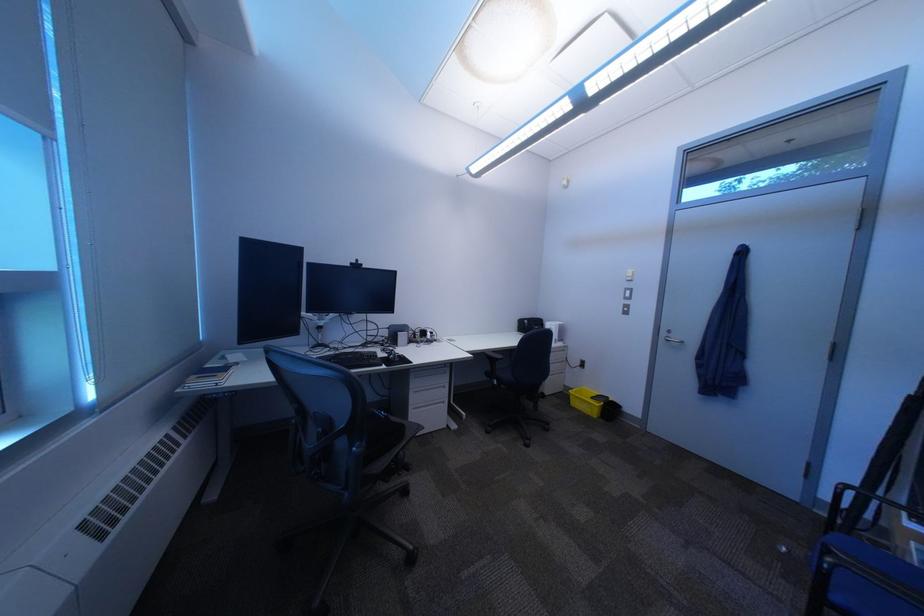
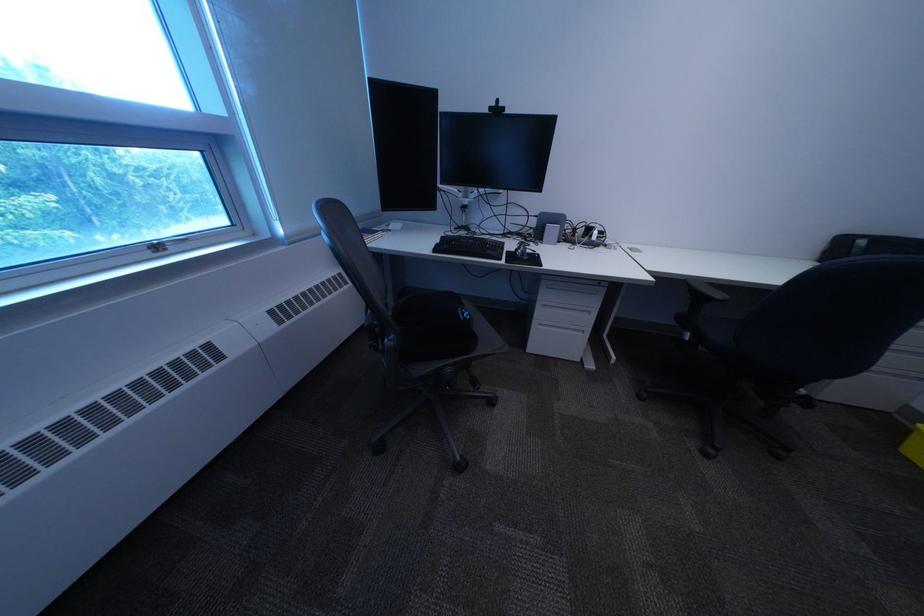
The point at [363,267] is marked in the first image. Where is the corresponding point in the second image?

(503, 113)